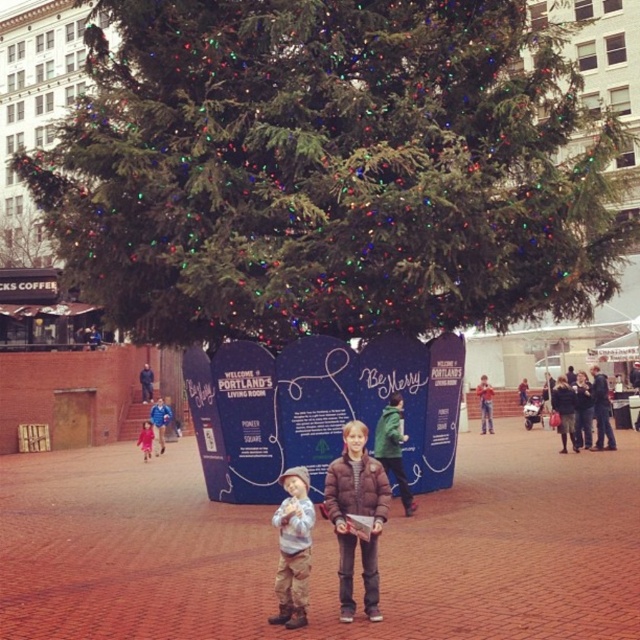
You are standing at the edge of the festive area and see a point marked at coordinates (x=358, y=515). What object is located at that point?

The point at coordinates (x=358, y=515) marks the brown textured jacket at center.

You are a photographer standing at the edge of the scene. You need to capture a photo that includes both the brown textured jacket at center and the matte pink coat at left. Given that your camera has a maximum focal length that allows capturing objects up to 120 feet apart, will you be able to include both subjects in a single frame?

The brown textured jacket at center and matte pink coat at left are 122.96 feet apart from each other. Since the camera can only capture up to 120 feet, the distance between them exceeds the maximum focal length. Therefore, you won not be able to include both subjects in a single frame.